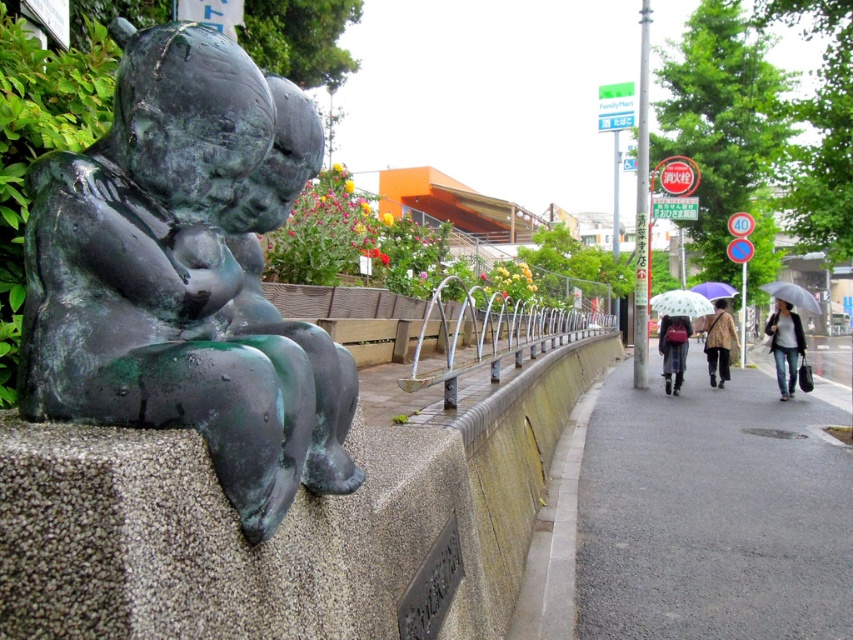
Question: Can you confirm if transparent fabric umbrella at center is positioned to the left of purple matte umbrella at center?

Choices:
 (A) yes
 (B) no

Answer: (A)

Question: Which point is closer to the camera?

Choices:
 (A) denim jacket at lower right
 (B) brown textured coat at center
 (C) matte black umbrella at center

Answer: (A)

Question: Does green patina bronze statue at left have a greater width compared to silver metallic rail at center?

Choices:
 (A) no
 (B) yes

Answer: (A)

Question: Where is gray asphalt pavement at lower right located in relation to matte black umbrella at center in the image?

Choices:
 (A) left
 (B) right

Answer: (A)

Question: Among these objects, which one is nearest to the camera?

Choices:
 (A) transparent plastic umbrella at right
 (B) brown textured coat at center
 (C) denim jacket at lower right

Answer: (A)

Question: Which point is farther from the camera taking this photo?

Choices:
 (A) (721, 356)
 (B) (772, 330)
 (C) (511, 333)

Answer: (A)